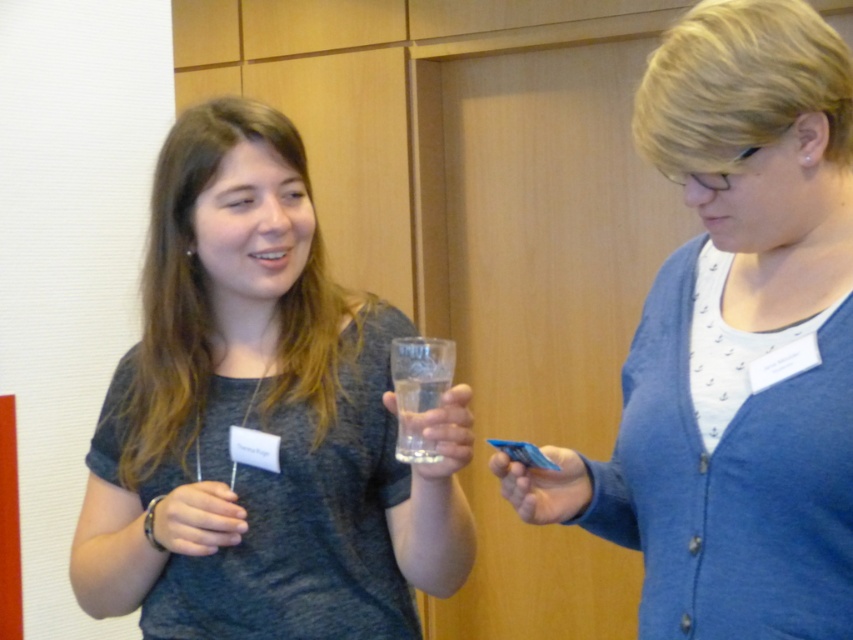
You are a healthcare worker who needs to scan the blue plastic card at center. The scanner is located at the position of the matte gray wristband at lower left. Can you reach the card without moving your hand from the wristband?

The distance between the matte gray wristband at lower left and the blue plastic card at center is 36.63 centimeters. Since the average human arm length is about 60 centimeters, you can easily reach the blue plastic card at center from the matte gray wristband at lower left.

You are organizing a card game and need to place two blue cards on a table. The blue card at center and the blue plastic card at center. Which one has a larger width?

The blue card at center has a larger width than the blue plastic card at center according to the description.

You are a security guard who needs to verify the credentials of the two people in the image. You notice both are holding a blue card at center and a blue plastic card at center. Which one is on top?

The blue card at center is positioned over the blue plastic card at center, so the blue card at center is on top.